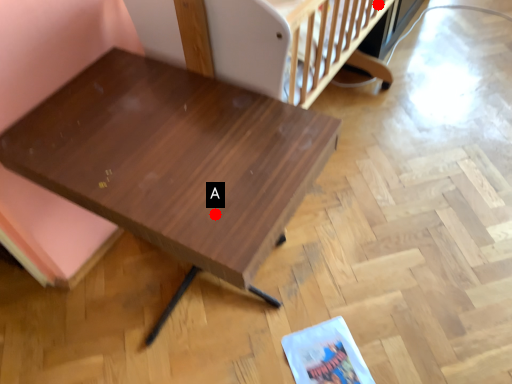
Question: Two points are circled on the image, labeled by A and B beside each circle. Which point is closer to the camera?

Choices:
 (A) A is closer
 (B) B is closer

Answer: (A)